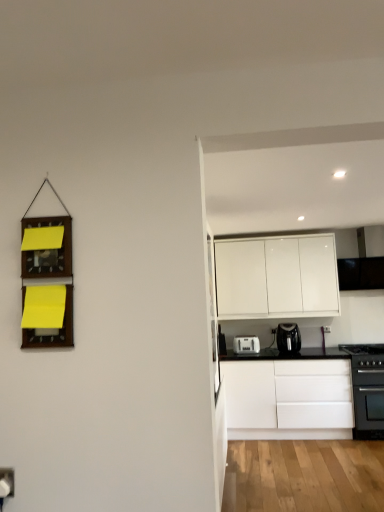
Locate an element on the screen. free spot below black plastic coffee maker at center, positioned as the 1th kitchen appliance in right-to-left order (from a real-world perspective) is located at coordinates pos(289,351).